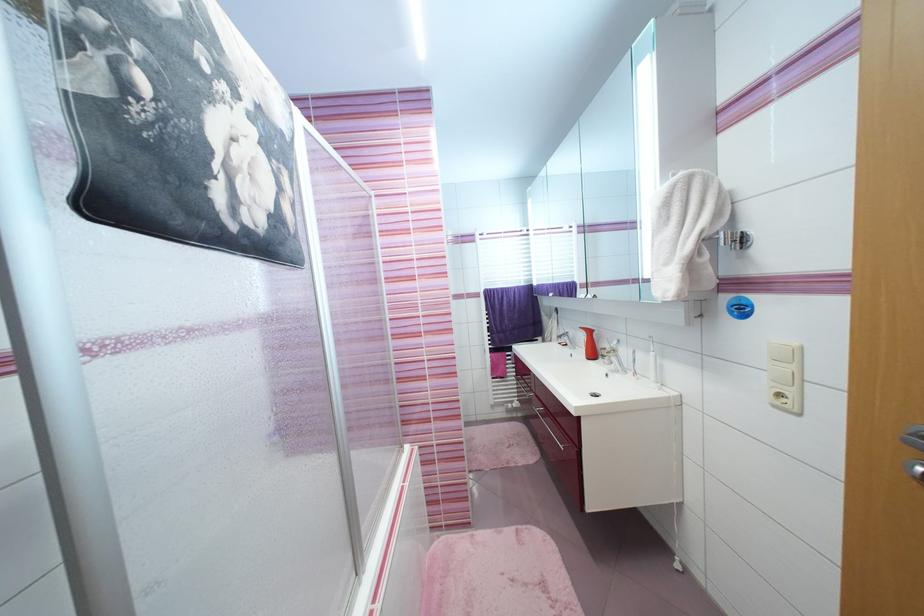
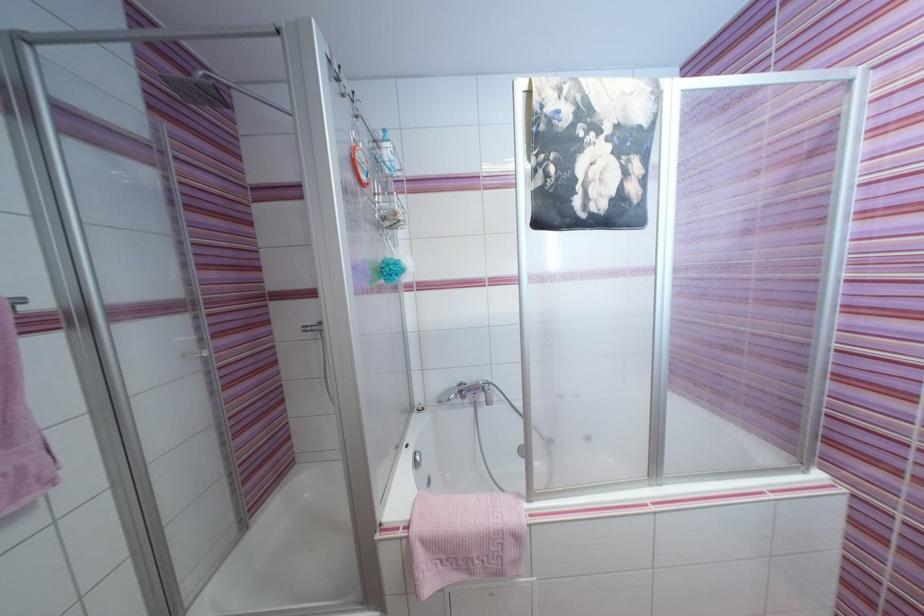
Find the pixel in the second image that matches [261,221] in the first image.

(604, 208)